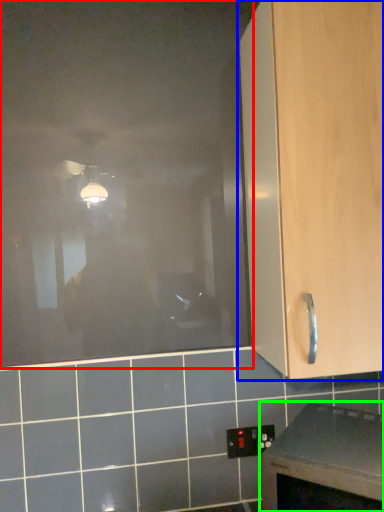
Question: Which object is the farthest from glass door (highlighted by a red box)? Choose among these: cabinetry (highlighted by a blue box) or countertop (highlighted by a green box).

Choices:
 (A) cabinetry
 (B) countertop

Answer: (B)